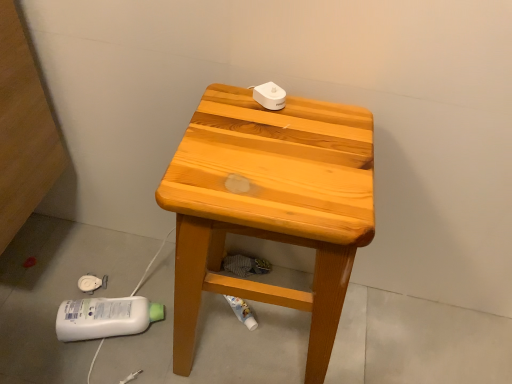
At what (x,y) coordinates should I click in order to perform the action: click on blank space situated above wooden stool at center (from a real-world perspective). Please return your answer as a coordinate pair (x, y). Looking at the image, I should click on (229, 331).